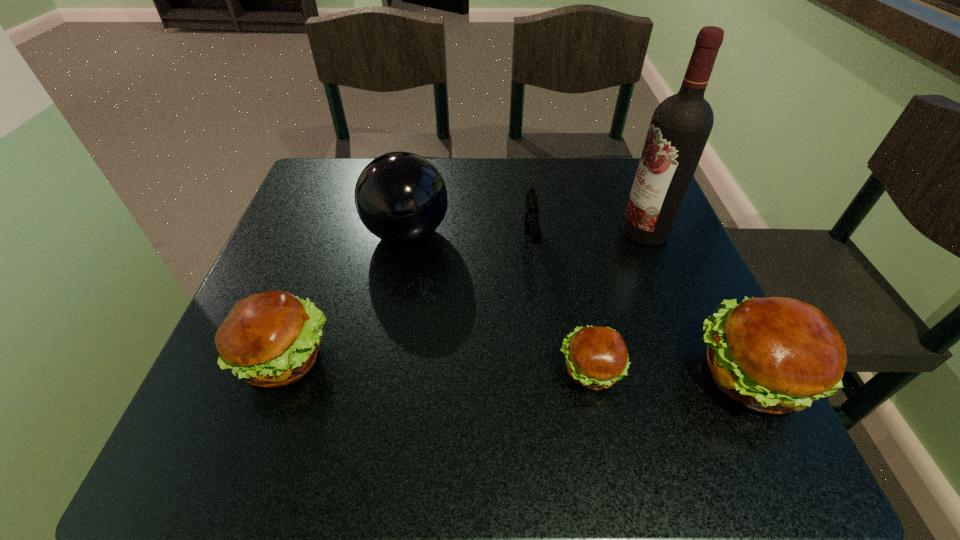
I want to click on object that stands as the closest to the wine bottle, so click(531, 220).

Identify which hamburger is the second closest to the shortest hamburger. Please provide its 2D coordinates. Your answer should be formatted as a tuple, i.e. [(x, y)], where the tuple contains the x and y coordinates of a point satisfying the conditions above.

[(270, 339)]

Point out which hamburger is positioned as the nearest to the second shortest hamburger. Please provide its 2D coordinates. Your answer should be formatted as a tuple, i.e. [(x, y)], where the tuple contains the x and y coordinates of a point satisfying the conditions above.

[(597, 357)]

Locate an element on the screen. Image resolution: width=960 pixels, height=540 pixels. vacant space that satisfies the following two spatial constraints: 1. on the label of the wine bottle; 2. on the front side of the leftmost hamburger is located at coordinates (696, 357).

Image resolution: width=960 pixels, height=540 pixels. In order to click on blank space that satisfies the following two spatial constraints: 1. on the front-facing side of the rightmost hamburger; 2. on the right side of the third object from left to right in this screenshot , I will do `click(546, 377)`.

Find the location of a particular element. free point that satisfies the following two spatial constraints: 1. on the side of the shortest object with the finger holes; 2. on the right side of the bowling ball is located at coordinates (383, 370).

At what (x,y) coordinates should I click in order to perform the action: click on free space in the image that satisfies the following two spatial constraints: 1. on the front-facing side of the rightmost hamburger; 2. on the left side of the fourth object from right to left. Please return your answer as a coordinate pair (x, y). Looking at the image, I should click on (546, 377).

I want to click on free space that satisfies the following two spatial constraints: 1. on the front-facing side of the fifth tallest object; 2. on the left side of the third object from right to left, so click(545, 370).

This screenshot has height=540, width=960. Identify the location of vacant area in the image that satisfies the following two spatial constraints: 1. on the side of the fifth shortest object with the finger holes; 2. on the back side of the shortest object. (383, 370).

This screenshot has width=960, height=540. I want to click on free space that satisfies the following two spatial constraints: 1. on the side of the fifth shortest object with the finger holes; 2. on the left side of the fourth object from left to right, so click(383, 370).